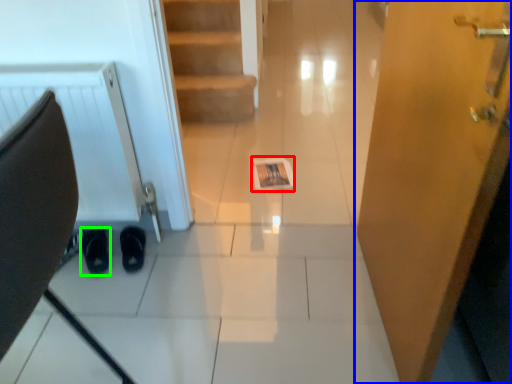
Question: Considering the real-world distances, which object is closest to magazine (highlighted by a red box)? door (highlighted by a blue box) or footwear (highlighted by a green box).

Choices:
 (A) door
 (B) footwear

Answer: (B)